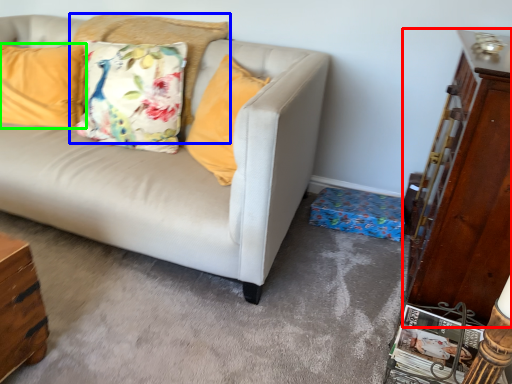
Question: Estimate the real-world distances between objects in this image. Which object is farther from dresser (highlighted by a red box), pillow (highlighted by a blue box) or pillow (highlighted by a green box)?

Choices:
 (A) pillow
 (B) pillow

Answer: (B)